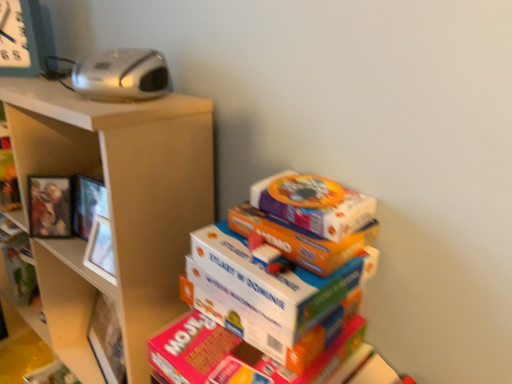
Question: From the image's perspective, is wooden photo frame at left located above or below matte brown shelf at upper left, arranged as the 2th shelf when viewed from the top?

Choices:
 (A) above
 (B) below

Answer: (A)

Question: In terms of size, does wooden photo frame at left appear bigger or smaller than matte brown shelf at upper left, the 1th shelf ordered from the bottom?

Choices:
 (A) small
 (B) big

Answer: (A)

Question: Which object is positioned farthest from the metallic gray clock at upper left?

Choices:
 (A) wooden shelf at left, the first shelf when ordered from top to bottom
 (B) multicolored cardboard boxes at center
 (C) wooden photo frame at left
 (D) silver plastic radio at upper left
 (E) matte brown shelf at upper left, the 1th shelf ordered from the bottom

Answer: (B)

Question: Which is farther from the metallic gray clock at upper left?

Choices:
 (A) multicolored cardboard boxes at center
 (B) silver plastic radio at upper left
 (C) wooden photo frame at left
 (D) matte brown shelf at upper left, arranged as the 2th shelf when viewed from the top
 (E) wooden shelf at left, the first shelf when ordered from top to bottom

Answer: (A)